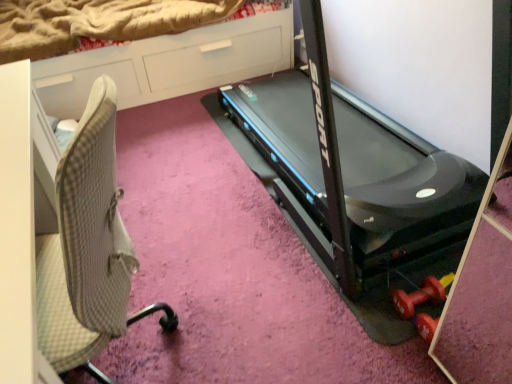
Question: From the image's perspective, would you say beige fabric chair at left is shown under black plastic treadmill at center?

Choices:
 (A) yes
 (B) no

Answer: (A)

Question: From a real-world perspective, is beige fabric chair at left physically above black plastic treadmill at center?

Choices:
 (A) yes
 (B) no

Answer: (B)

Question: Is beige fabric chair at left further to camera compared to black plastic treadmill at center?

Choices:
 (A) no
 (B) yes

Answer: (A)

Question: Considering the relative sizes of beige fabric chair at left and black plastic treadmill at center in the image provided, is beige fabric chair at left smaller than black plastic treadmill at center?

Choices:
 (A) yes
 (B) no

Answer: (A)

Question: Does beige fabric chair at left appear on the left side of black plastic treadmill at center?

Choices:
 (A) no
 (B) yes

Answer: (B)

Question: Relative to black plastic treadmill at center, is beige fabric chair at left in front or behind?

Choices:
 (A) front
 (B) behind

Answer: (A)

Question: Is point (29, 170) positioned closer to the camera than point (422, 187)?

Choices:
 (A) closer
 (B) farther

Answer: (A)

Question: From the image's perspective, is beige fabric chair at left above or below black plastic treadmill at center?

Choices:
 (A) below
 (B) above

Answer: (A)

Question: Based on their sizes in the image, would you say beige fabric chair at left is bigger or smaller than black plastic treadmill at center?

Choices:
 (A) big
 (B) small

Answer: (B)

Question: In the image, is black plastic treadmill at center positioned in front of or behind beige fabric chair at left?

Choices:
 (A) front
 (B) behind

Answer: (B)

Question: Is point (433, 145) positioned closer to the camera than point (0, 104)?

Choices:
 (A) closer
 (B) farther

Answer: (B)

Question: Considering the positions of black plastic treadmill at center and beige fabric chair at left in the image, is black plastic treadmill at center taller or shorter than beige fabric chair at left?

Choices:
 (A) short
 (B) tall

Answer: (B)

Question: Considering the relative positions of black plastic treadmill at center and beige fabric chair at left in the image provided, is black plastic treadmill at center to the left or to the right of beige fabric chair at left?

Choices:
 (A) right
 (B) left

Answer: (A)

Question: Considering the positions of beige fabric chair at left and white glossy dresser at upper left in the image, is beige fabric chair at left wider or thinner than white glossy dresser at upper left?

Choices:
 (A) wide
 (B) thin

Answer: (B)

Question: Is beige fabric chair at left in front of or behind white glossy dresser at upper left in the image?

Choices:
 (A) front
 (B) behind

Answer: (A)